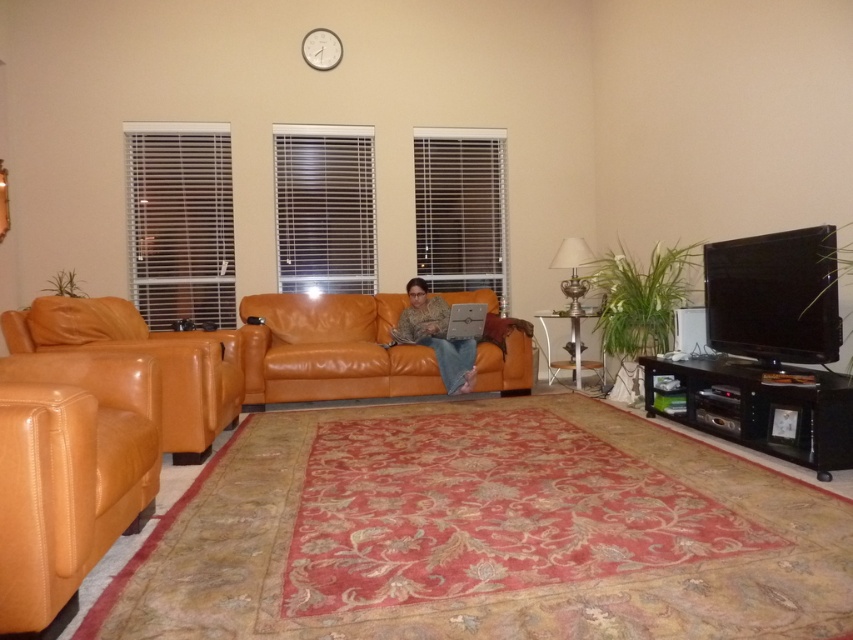
Is saddle brown leather armchair at left below matte leather chair at left?

Indeed, saddle brown leather armchair at left is positioned under matte leather chair at left.

Does saddle brown leather armchair at left lie in front of matte leather chair at left?

Yes, saddle brown leather armchair at left is in front of matte leather chair at left.

The image size is (853, 640). Find the location of `saddle brown leather armchair at left`. saddle brown leather armchair at left is located at coordinates (68, 472).

Can you confirm if matte leather chair at left is positioned above camouflage fabric shirt at center?

Actually, matte leather chair at left is below camouflage fabric shirt at center.

Can you confirm if matte leather chair at left is positioned to the left of camouflage fabric shirt at center?

Correct, you'll find matte leather chair at left to the left of camouflage fabric shirt at center.

At what (x,y) coordinates should I click in order to perform the action: click on matte leather chair at left. Please return your answer as a coordinate pair (x, y). This screenshot has height=640, width=853. Looking at the image, I should click on (149, 355).

This screenshot has height=640, width=853. In order to click on matte leather chair at left in this screenshot , I will do `click(149, 355)`.

Can you confirm if saddle brown leather armchair at left is bigger than orange leather couch at center?

Indeed, saddle brown leather armchair at left has a larger size compared to orange leather couch at center.

Consider the image. Which of these two, saddle brown leather armchair at left or orange leather couch at center, stands shorter?

With less height is orange leather couch at center.

Is point (27, 428) positioned after point (271, 378)?

That is False.

You are a GUI agent. You are given a task and a screenshot of the screen. Output one action in this format:
    pyautogui.click(x=<x>, y=<y>)
    Task: Click on the saddle brown leather armchair at left
    
    Given the screenshot: What is the action you would take?
    pyautogui.click(x=68, y=472)